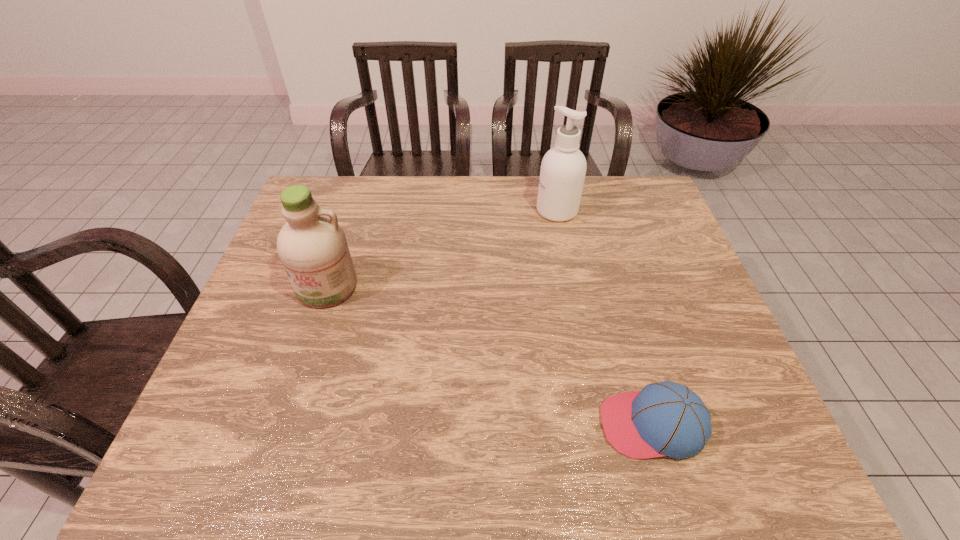
Identify the location of free space between the farthest object and the leftmost object. Image resolution: width=960 pixels, height=540 pixels. (442, 248).

The height and width of the screenshot is (540, 960). Identify the location of empty space between the right cleansing agent and the baseball cap. (605, 318).

This screenshot has width=960, height=540. What are the coordinates of `empty space between the baseball cap and the nearer cleansing agent` in the screenshot? It's located at (490, 356).

The width and height of the screenshot is (960, 540). What are the coordinates of `free spot between the right cleansing agent and the left cleansing agent` in the screenshot? It's located at (442, 248).

Image resolution: width=960 pixels, height=540 pixels. Find the location of `object that is the second closest to the nearest object`. object that is the second closest to the nearest object is located at coordinates (312, 246).

Identify which object is the second nearest to the second nearest object. Please provide its 2D coordinates. Your answer should be formatted as a tuple, i.e. [(x, y)], where the tuple contains the x and y coordinates of a point satisfying the conditions above.

[(668, 419)]

Find the location of a particular element. The image size is (960, 540). free space that satisfies the following two spatial constraints: 1. on the front label of the farther cleansing agent; 2. on the front label of the nearer cleansing agent is located at coordinates (572, 287).

Image resolution: width=960 pixels, height=540 pixels. Identify the location of vacant area that satisfies the following two spatial constraints: 1. on the front label of the right cleansing agent; 2. on the front label of the nearer cleansing agent. (572, 287).